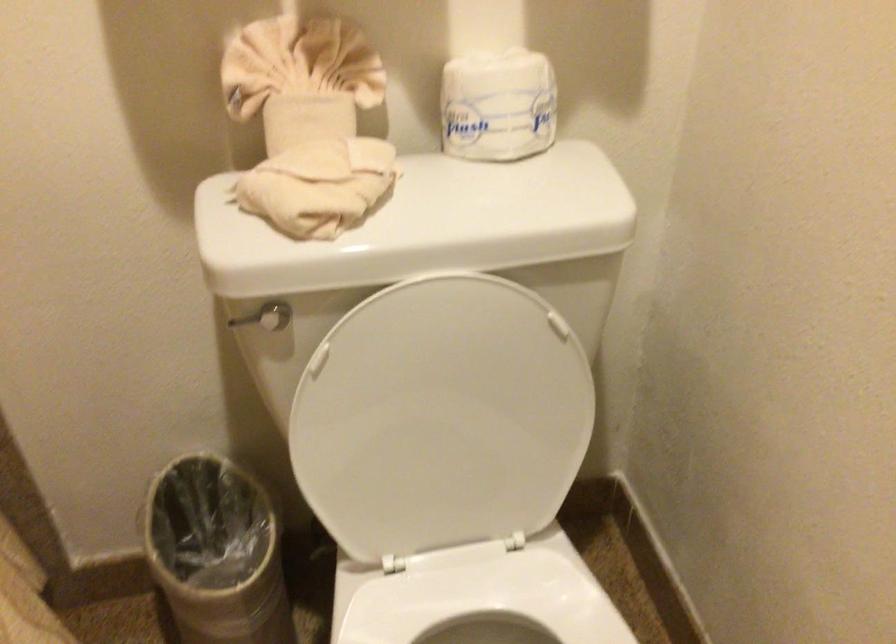
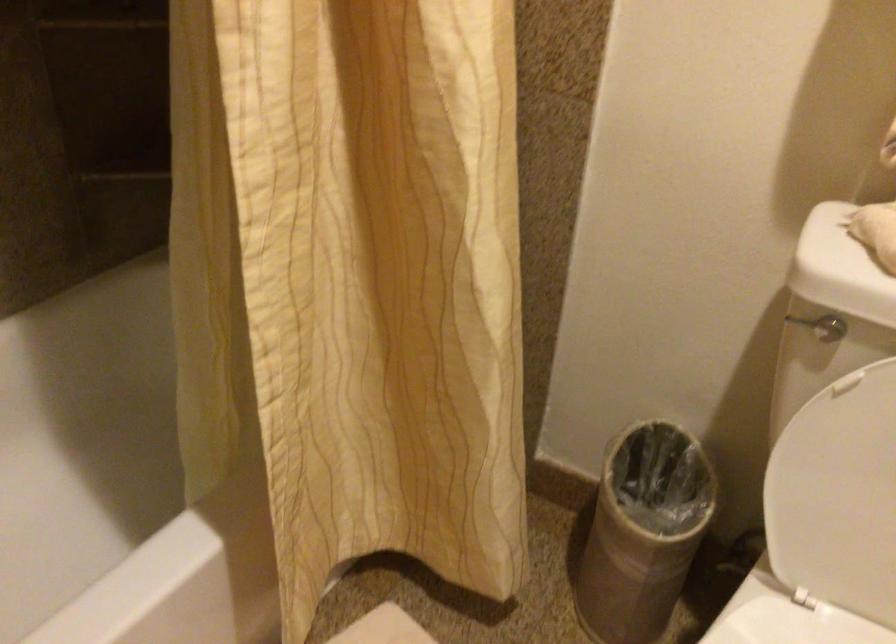
Locate, in the second image, the point that corresponds to (x=364, y=450) in the first image.

(834, 480)